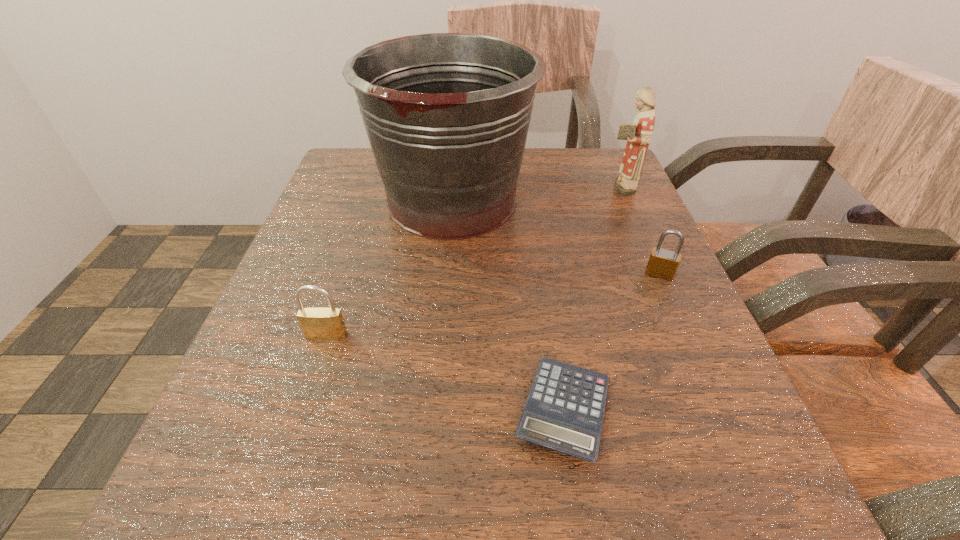
At what (x,y) coordinates should I click in order to perform the action: click on free space that satisfies the following two spatial constraints: 1. on the front-facing side of the nearest object; 2. on the left side of the fourth farthest object. Please return your answer as a coordinate pair (x, y). This screenshot has width=960, height=540. Looking at the image, I should click on (302, 409).